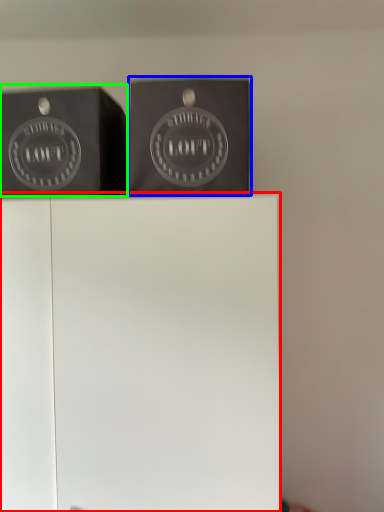
Question: Which object is positioned farthest from furniture (highlighted by a red box)? Select from package (highlighted by a blue box) and writing (highlighted by a green box).

Choices:
 (A) package
 (B) writing

Answer: (B)